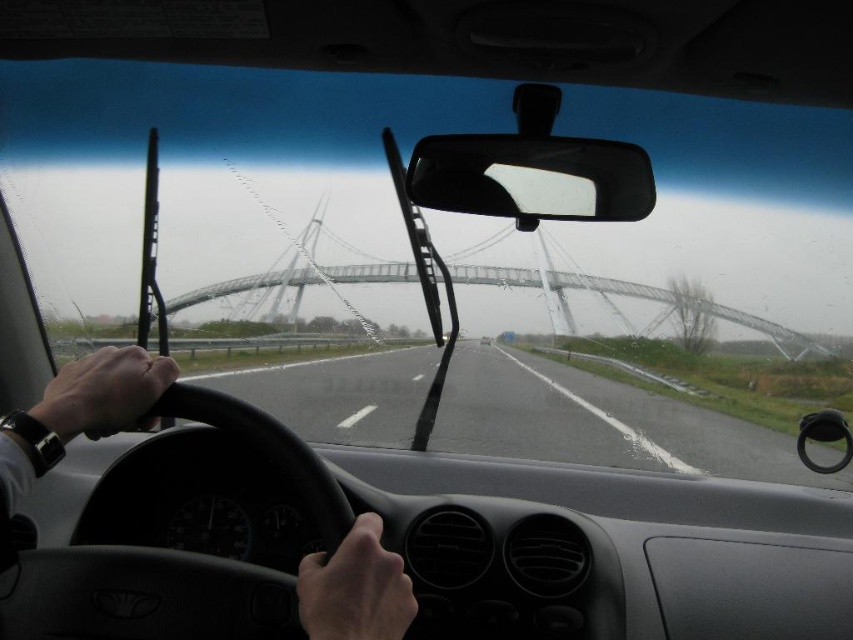
You are a passenger in the car and want to compare the sizes of the objects you see through the windshield. Which object, the black leather steering wheel at center or the transparent glass bridge at center, appears smaller in height from your viewpoint?

The black leather steering wheel at center appears smaller in height compared to the transparent glass bridge at center because it has a lesser height according to the description.

You are a driver who needs to cross the transparent glass bridge at center. Based on the scene, which path should you follow to stay on the asphalt road at center?

The asphalt road at center is larger in size than the transparent glass bridge at center, so you should stay on the asphalt road at center by following its wider path which likely aligns with the bridge.

Consider the image. You are a driver who wants to stay on the asphalt road at center. Based on the scene, where should you position your car relative to the road?

The asphalt road at center is located at point (601, 422), so you should position your car to align with that central point to stay on the road.